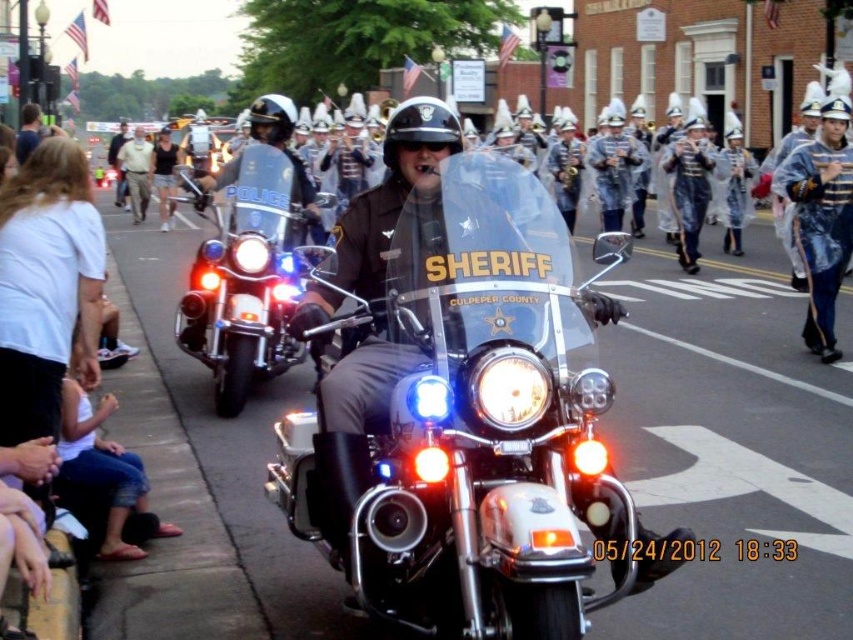
Between polished chrome motorcycle at center and shiny chrome police motorcycle at center, which one appears on the left side from the viewer's perspective?

Positioned to the left is shiny chrome police motorcycle at center.

Who is taller, polished chrome motorcycle at center or shiny chrome police motorcycle at center?

shiny chrome police motorcycle at center is taller.

The width and height of the screenshot is (853, 640). In order to click on polished chrome motorcycle at center in this screenshot , I will do `click(457, 440)`.

This screenshot has height=640, width=853. Identify the location of polished chrome motorcycle at center. (457, 440).